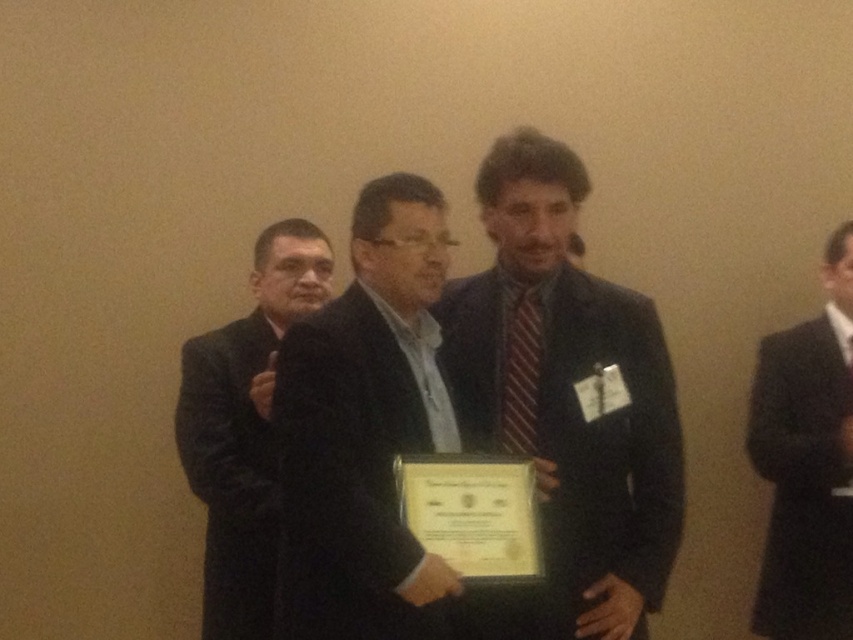
From the picture: You are organizing a photo album and want to place the black matte suit at left and the striped fabric tie at center in order from left to right. Which should come first?

The black matte suit at left is positioned on the left side of striped fabric tie at center, so it should come first in the left to right order.

In the scene, there are a black suit at right and a striped fabric tie at center. Which object takes up more space in the image?

The black suit at right has a larger size compared to striped fabric tie at center, so it takes up more space in the image.